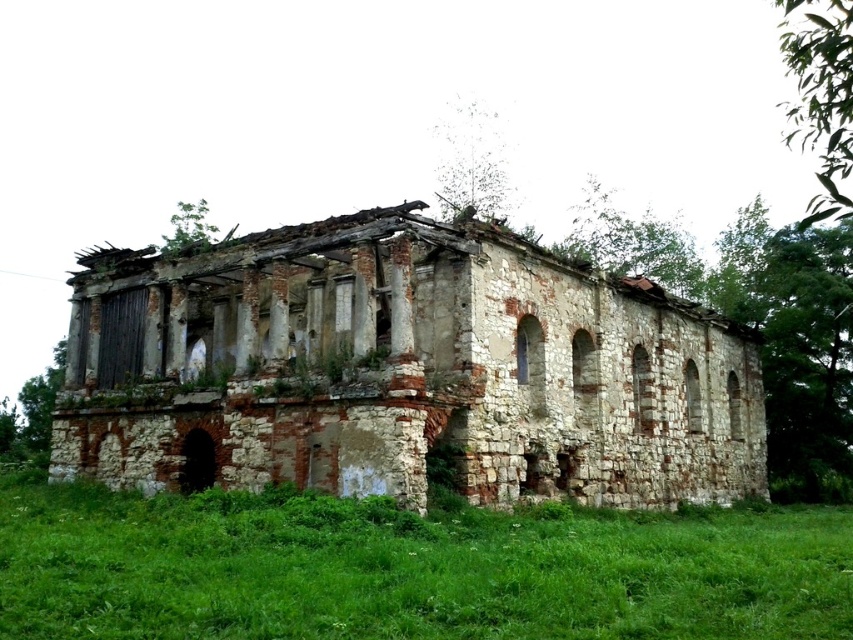
You are standing in the grassy area near the weathered stone ruins at center. If you walk straight ahead, will you eventually see the sky through the trees in the background?

Yes, because the trees in the background do not completely block the sky, allowing visibility through them.

You are a landscape architect evaluating the site for a new garden. You notice the weathered stone ruins at center and the green grass at lower center. Which object occupies a greater area in the scene?

The weathered stone ruins at center is larger in size than the green grass at lower center, so the weathered stone ruins at center occupies a greater area in the scene.